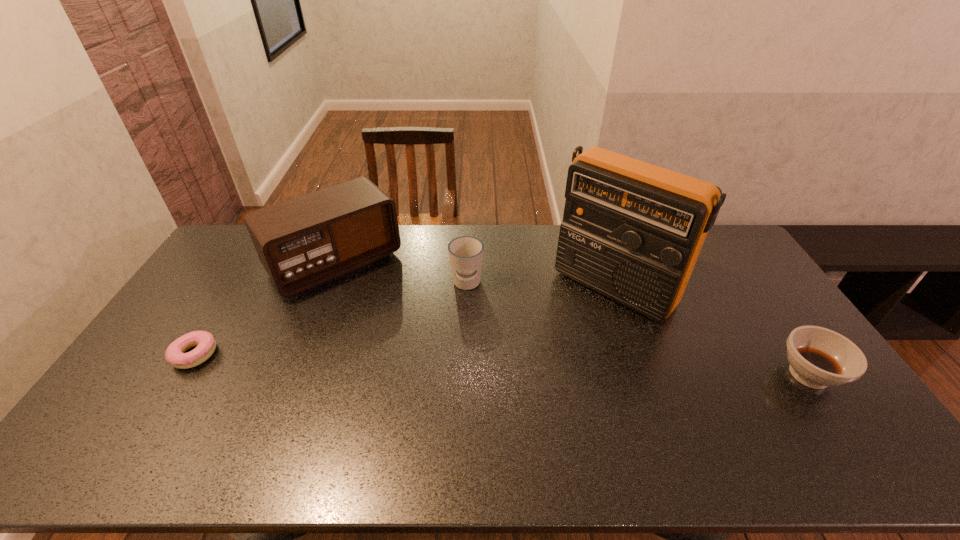
Where is `vacant spot on the desktop that is between the doughnut and the second shortest object and is positioned with a handle on the side of the third object from left to right`? This screenshot has width=960, height=540. vacant spot on the desktop that is between the doughnut and the second shortest object and is positioned with a handle on the side of the third object from left to right is located at coordinates (456, 363).

The image size is (960, 540). I want to click on free space on the desktop that is between the shortest object and the fourth tallest object and is positioned on the front-facing side of the right radio receiver, so [x=540, y=366].

You are a GUI agent. You are given a task and a screenshot of the screen. Output one action in this format:
    pyautogui.click(x=<x>, y=<y>)
    Task: Click on the free space on the desktop that is between the leftmost object and the soup bowl and is positioned on the front-facing side of the fourth shortest object
    This screenshot has width=960, height=540.
    Given the screenshot: What is the action you would take?
    pyautogui.click(x=415, y=362)